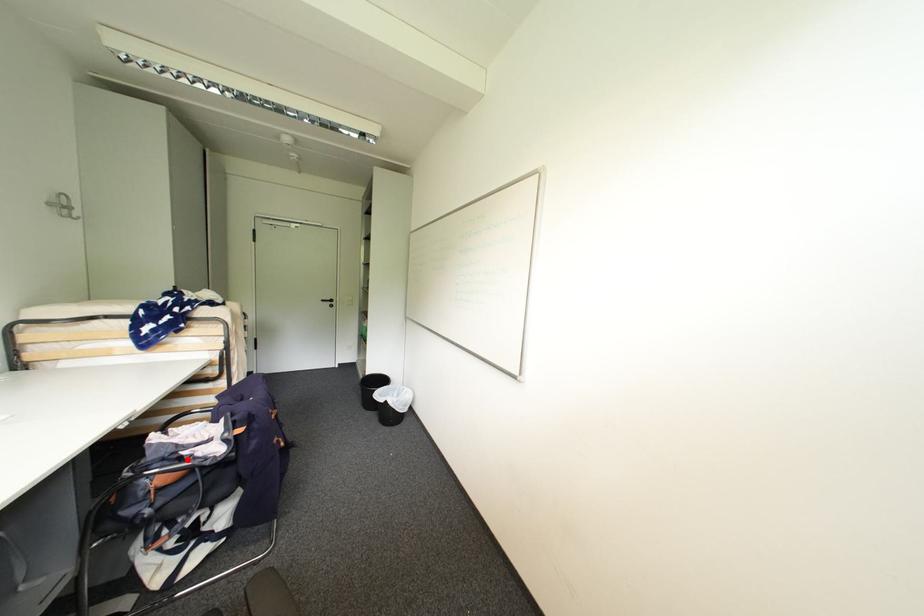
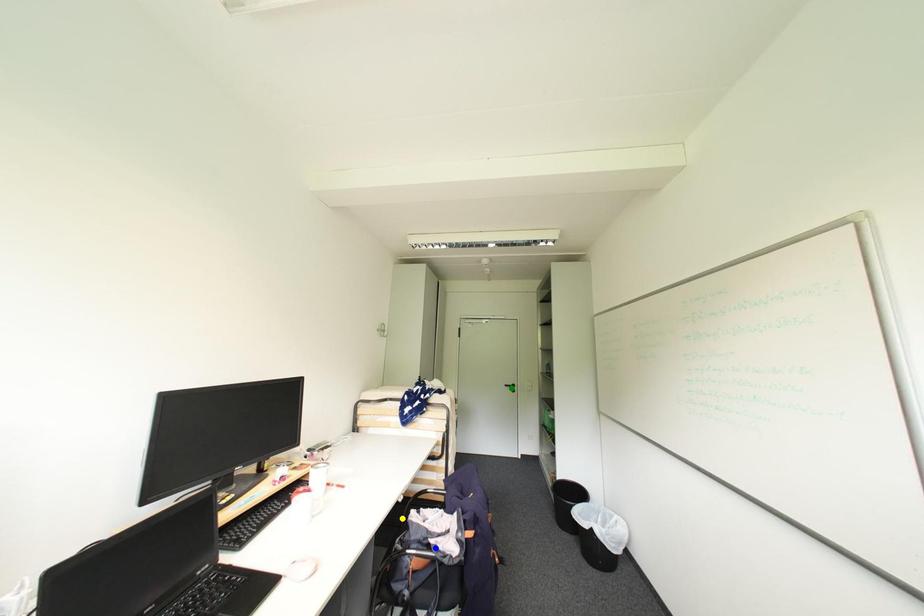
Question: I am providing you with two images of the same scene from different viewpoints. A red point is marked on the first image. You are given multiple points on the second image. Can you choose the point in image 2 that corresponds to the point in image 1?

Choices:
 (A) blue point
 (B) yellow point
 (C) green point

Answer: (A)